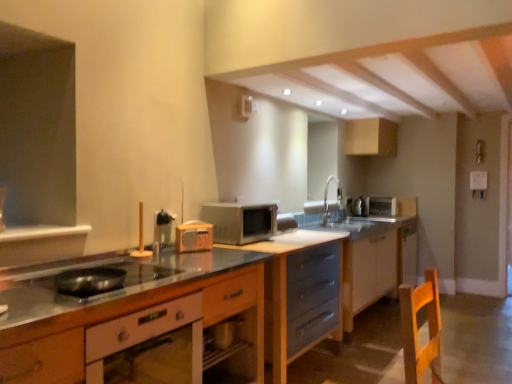
Question: Considering the relative sizes of matte gray drawers at center, which is the third cabinetry from front to back, and white glossy cabinet at lower right, which is the 4th cabinetry in front-to-back order, in the image provided, is matte gray drawers at center, which is the third cabinetry from front to back, taller than white glossy cabinet at lower right, which is the 4th cabinetry in front-to-back order,?

Choices:
 (A) yes
 (B) no

Answer: (A)

Question: Can you confirm if matte gray drawers at center, the third cabinetry when ordered from back to front, is bigger than white glossy cabinet at lower right, which is the 4th cabinetry in front-to-back order?

Choices:
 (A) no
 (B) yes

Answer: (B)

Question: Does matte gray drawers at center, the third cabinetry when ordered from back to front, have a smaller size compared to white glossy cabinet at lower right, which is the 4th cabinetry in front-to-back order?

Choices:
 (A) yes
 (B) no

Answer: (B)

Question: Does matte gray drawers at center, the third cabinetry when ordered from back to front, come behind white glossy cabinet at lower right, which is the 4th cabinetry in front-to-back order?

Choices:
 (A) no
 (B) yes

Answer: (A)

Question: Is matte gray drawers at center, which is the third cabinetry from front to back, facing away from white glossy cabinet at lower right, which is the 4th cabinetry in front-to-back order?

Choices:
 (A) yes
 (B) no

Answer: (B)

Question: From a real-world perspective, is wooden radio at center, the third appliance when ordered from right to left, physically located above or below matte gray drawers at center, positioned as the 2th cabinetry in front-to-back order?

Choices:
 (A) above
 (B) below

Answer: (A)

Question: In the image, is wooden radio at center, the third appliance in the back-to-front sequence, positioned in front of or behind matte gray drawers at center, positioned as the 2th cabinetry in front-to-back order?

Choices:
 (A) behind
 (B) front

Answer: (A)

Question: From the image's perspective, is wooden radio at center, placed as the 1th appliance when sorted from front to back, above or below matte gray drawers at center, the 4th cabinetry in the back-to-front sequence?

Choices:
 (A) above
 (B) below

Answer: (A)

Question: Is wooden radio at center, the third appliance in the back-to-front sequence, taller or shorter than matte gray drawers at center, positioned as the 2th cabinetry in front-to-back order?

Choices:
 (A) tall
 (B) short

Answer: (B)

Question: Considering the positions of point (328, 203) and point (339, 314), is point (328, 203) closer or farther from the camera than point (339, 314)?

Choices:
 (A) closer
 (B) farther

Answer: (B)

Question: Do you think silver metallic faucet at upper center is within matte gray drawers at center, the 4th cabinetry in the back-to-front sequence, or outside of it?

Choices:
 (A) outside
 (B) inside

Answer: (A)

Question: From the image's perspective, is silver metallic faucet at upper center above or below matte gray drawers at center, positioned as the 2th cabinetry in front-to-back order?

Choices:
 (A) above
 (B) below

Answer: (A)

Question: Is silver metallic faucet at upper center bigger or smaller than matte gray drawers at center, the 4th cabinetry in the back-to-front sequence?

Choices:
 (A) big
 (B) small

Answer: (B)

Question: Is matte gray drawers at center, which is the third cabinetry from front to back, inside or outside of satin silver microwave at center?

Choices:
 (A) outside
 (B) inside

Answer: (A)

Question: From a real-world perspective, is matte gray drawers at center, which is the third cabinetry from front to back, positioned above or below satin silver microwave at center?

Choices:
 (A) above
 (B) below

Answer: (B)